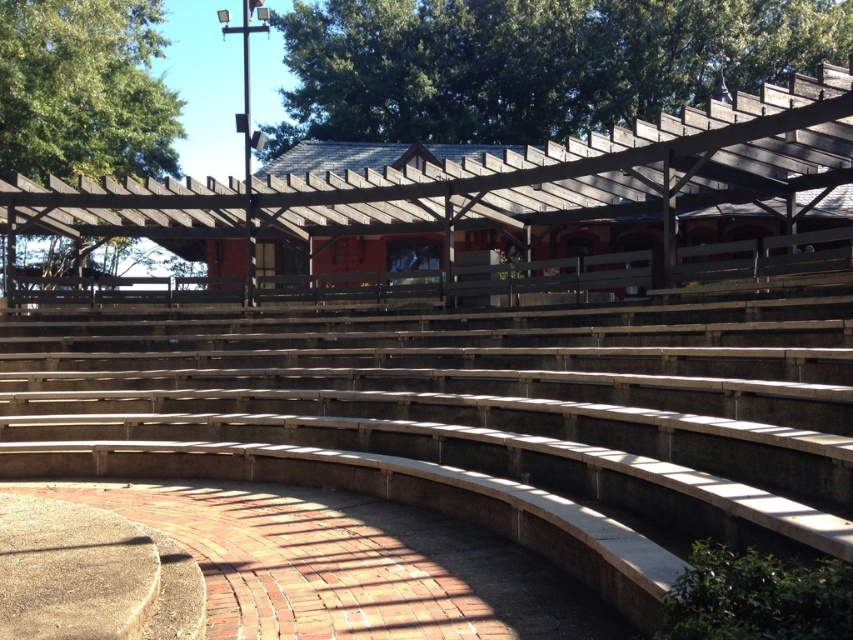
Question: Can you confirm if wooden bench at center is positioned to the right of green leafy tree at upper center?

Choices:
 (A) no
 (B) yes

Answer: (A)

Question: Does wooden bench at center have a lesser width compared to green leafy tree at upper left?

Choices:
 (A) no
 (B) yes

Answer: (A)

Question: Estimate the real-world distances between objects in this image. Which object is closer to the wooden bench at center?

Choices:
 (A) green leafy tree at upper center
 (B) green leafy tree at upper left

Answer: (B)

Question: Which object is positioned farthest from the green leafy tree at upper left?

Choices:
 (A) wooden bench at center
 (B) green leafy tree at upper center

Answer: (A)

Question: From the image, what is the correct spatial relationship of wooden bench at center in relation to green leafy tree at upper left?

Choices:
 (A) right
 (B) left

Answer: (A)

Question: Considering the real-world distances, which object is farthest from the wooden bench at center?

Choices:
 (A) green leafy tree at upper center
 (B) green leafy tree at upper left

Answer: (A)